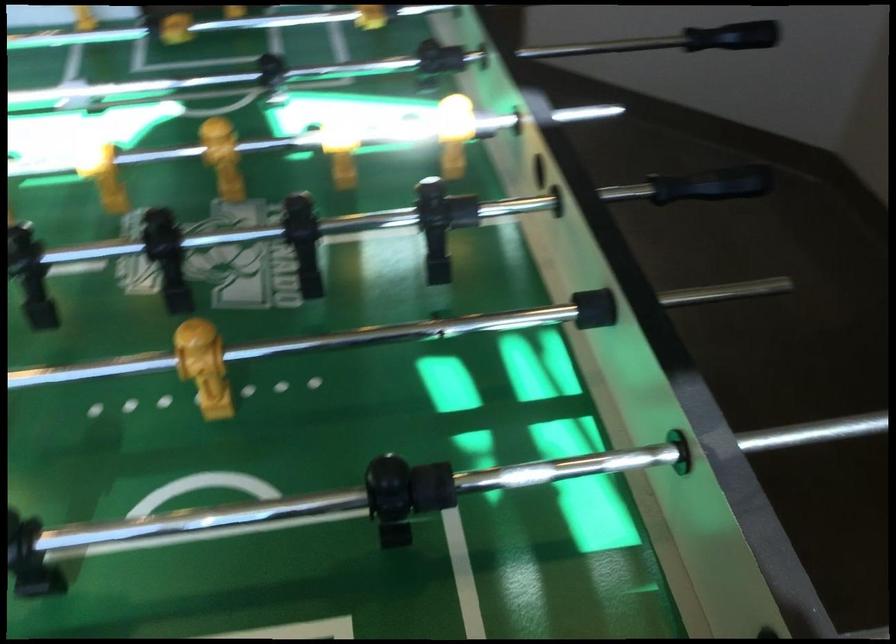
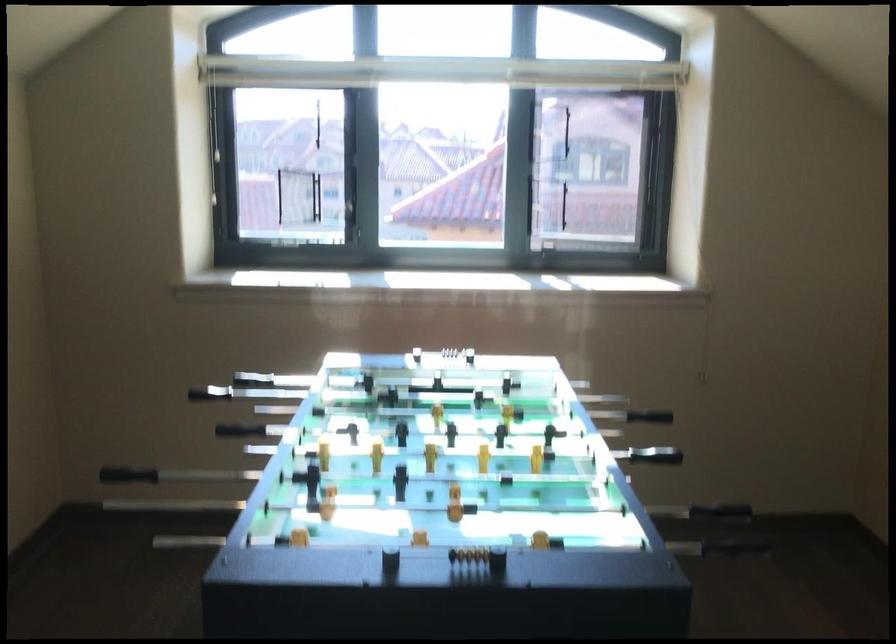
In the second image, find the point that corresponds to point 733,37 in the first image.

(99, 494)